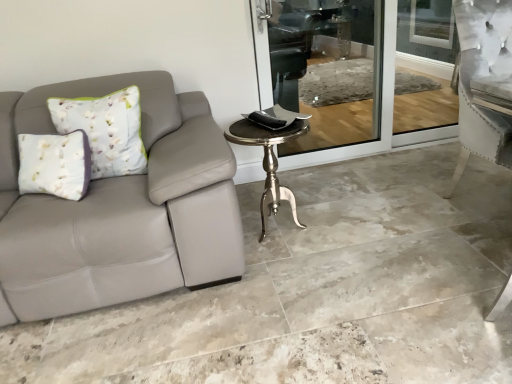
Find the location of a particular element. The width and height of the screenshot is (512, 384). vacant space underneath polished brass table at center (from a real-world perspective) is located at coordinates (279, 234).